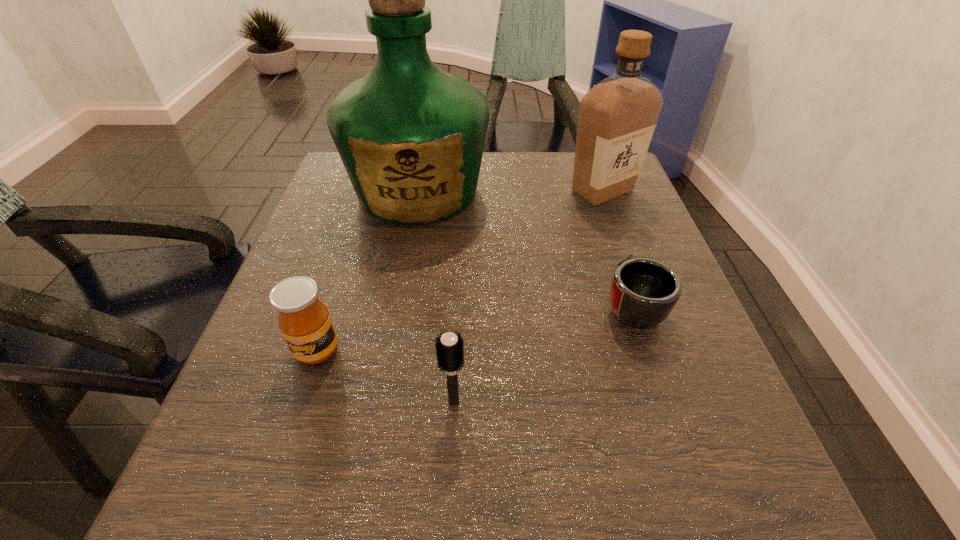
Where is `vacant region at the far edge of the desktop`? Image resolution: width=960 pixels, height=540 pixels. vacant region at the far edge of the desktop is located at coordinates (515, 151).

The height and width of the screenshot is (540, 960). I want to click on vacant space at the near edge of the desktop, so click(x=377, y=492).

The height and width of the screenshot is (540, 960). I want to click on vacant space at the left edge of the desktop, so click(343, 226).

Where is `vacant region at the right edge of the desktop`? vacant region at the right edge of the desktop is located at coordinates (627, 251).

In the image, there is a desktop. Find the location of `vacant space at the far left corner`. vacant space at the far left corner is located at coordinates (325, 194).

This screenshot has width=960, height=540. Find the location of `vacant position at the near left corner of the desktop`. vacant position at the near left corner of the desktop is located at coordinates (252, 525).

Locate an element on the screen. This screenshot has width=960, height=540. vacant space at the far right corner is located at coordinates (628, 193).

Where is `vacant space at the near right corner`? vacant space at the near right corner is located at coordinates (731, 494).

Locate an element on the screen. The height and width of the screenshot is (540, 960). unoccupied area between the right liquor and the honey is located at coordinates (460, 271).

Identify the location of free space between the tallest object and the nearest object. Image resolution: width=960 pixels, height=540 pixels. 436,296.